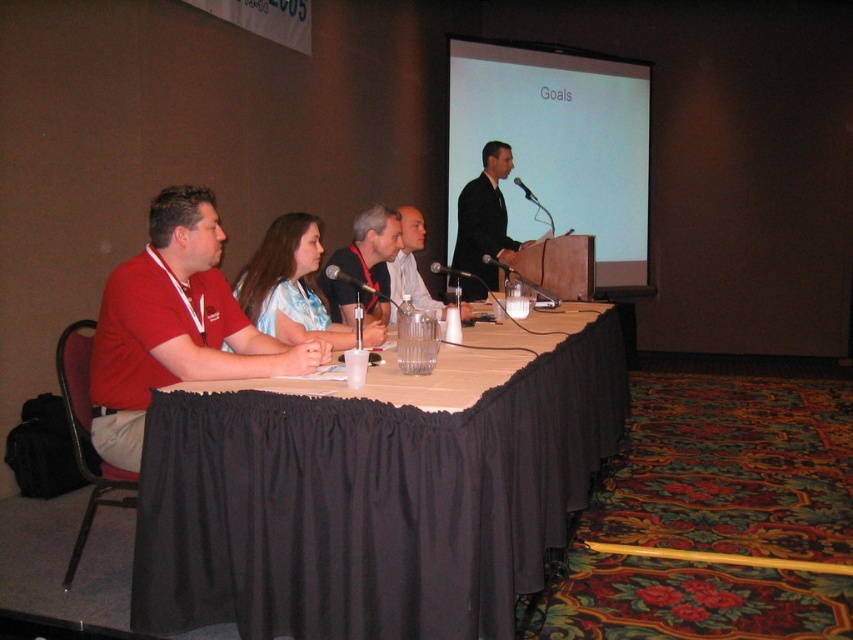
Question: Does black fabric table at center have a larger size compared to white matte projection screen at upper center?

Choices:
 (A) no
 (B) yes

Answer: (A)

Question: Which of the following is the farthest from the observer?

Choices:
 (A) (492, 141)
 (B) (328, 280)
 (C) (341, 346)
 (D) (509, 193)

Answer: (D)

Question: Which object appears closest to the camera in this image?

Choices:
 (A) matte black shirt at center
 (B) black suit at center
 (C) white matte projection screen at upper center

Answer: (A)

Question: Does black fabric table at center have a larger size compared to black suit at center?

Choices:
 (A) no
 (B) yes

Answer: (B)

Question: Among these objects, which one is nearest to the camera?

Choices:
 (A) black fabric table at center
 (B) matte black shirt at center
 (C) matte white shirt at center

Answer: (A)

Question: Where is white matte projection screen at upper center located in relation to matte red shirt at left in the image?

Choices:
 (A) above
 (B) below

Answer: (A)